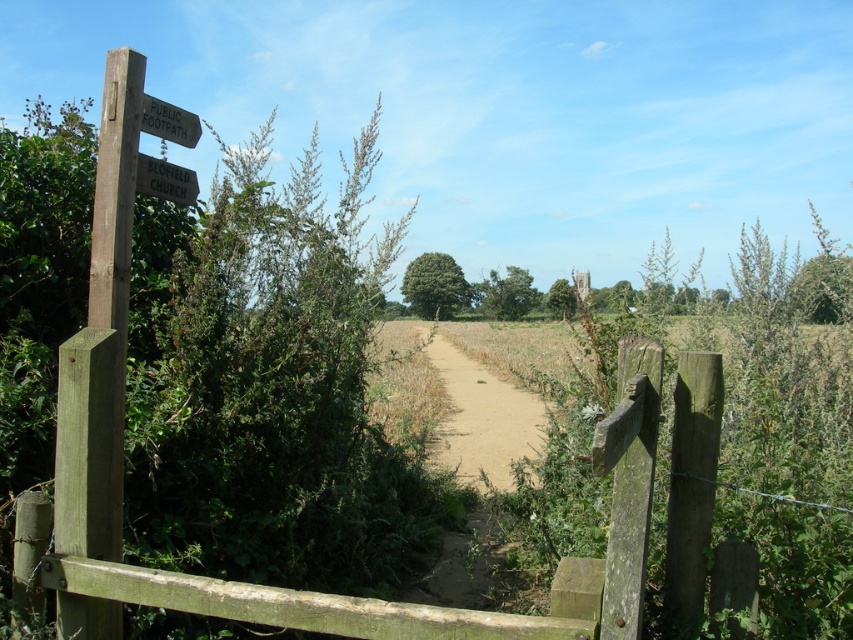
Question: Among these objects, which one is farthest from the camera?

Choices:
 (A) dirt path at center
 (B) wooden signpost at left
 (C) wooden gate at center

Answer: (A)

Question: Which object is the farthest from the wooden signpost at left?

Choices:
 (A) dirt path at center
 (B) wooden gate at center
 (C) wooden signpost at upper left

Answer: (A)

Question: Which of the following is the farthest from the observer?

Choices:
 (A) (558, 579)
 (B) (187, 138)
 (C) (140, 180)

Answer: (B)

Question: Where is wooden signpost at left located in relation to wooden signpost at upper left in the image?

Choices:
 (A) below
 (B) above

Answer: (A)

Question: Does dirt path at center appear under wooden signpost at upper left?

Choices:
 (A) no
 (B) yes

Answer: (B)

Question: Can you confirm if dirt path at center is positioned to the right of wooden signpost at left?

Choices:
 (A) no
 (B) yes

Answer: (B)